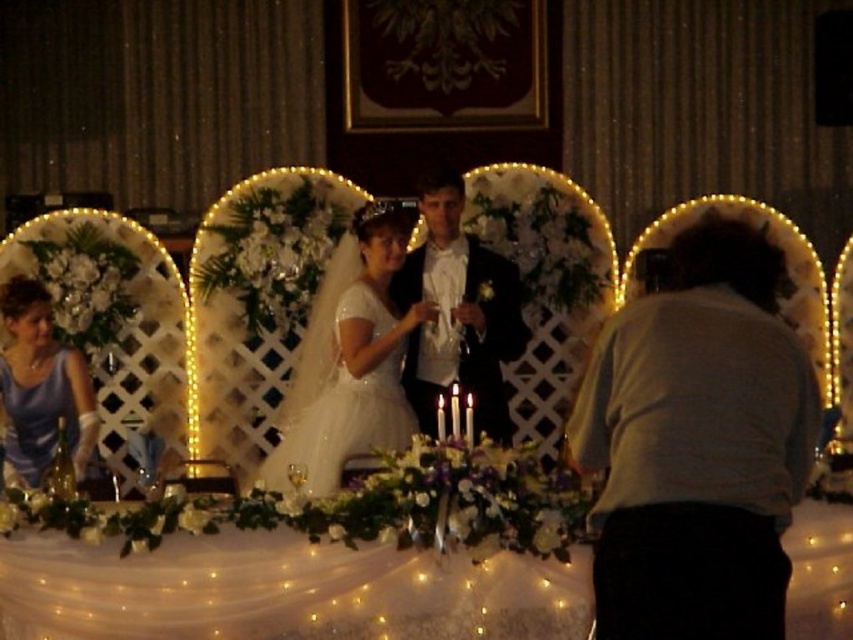
In the scene shown: You are a photographer at the wedding reception. You need to capture a photo of the white satin dress at center and the matte blue dress at left. According to the scene description, which dress is positioned to the right of the other?

The white satin dress at center is positioned on the right side of the matte blue dress at left.

You are a photographer standing at the back of the reception hall. You want to take a photo of the white lace tablecloth at lower center and the shiny black suit at center. Given that your camera has a maximum focus range of 50 feet, can you capture both objects in focus without moving closer?

The white lace tablecloth at lower center is 52.30 feet away from the shiny black suit at center. Since the distance between them exceeds the camera maximum focus range of 50 feet, you cannot capture both objects in focus without moving closer.

You are a photographer at the wedding reception. You want to capture a closeup of the couple while ensuring both the decorative points at point (320,298) and point (13,456) are visible in the frame. Which point should you focus on to ensure both are in focus?

You should focus on point (320,298) because it is closer to the camera than point (13,456), ensuring both are within the depth of field.